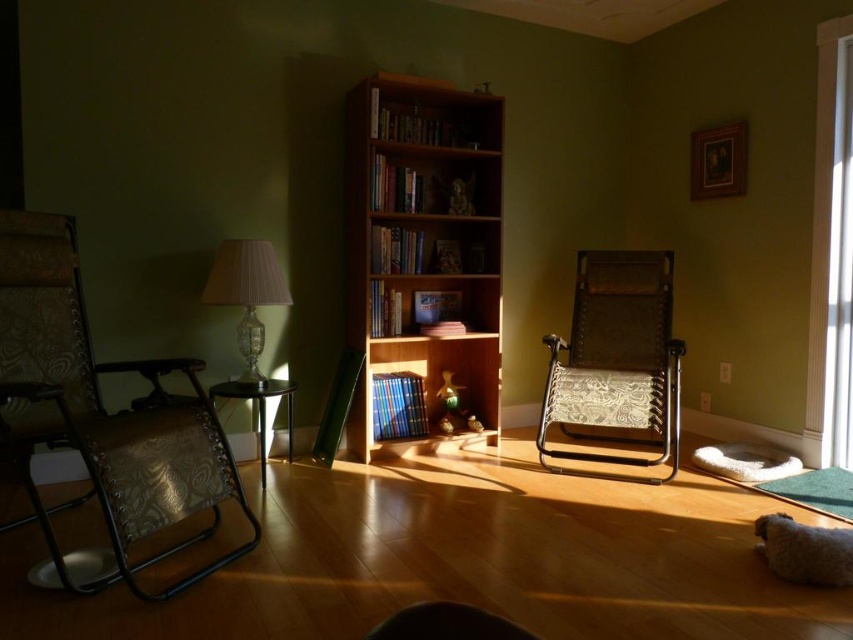
Question: Which object is the closest to the clear glass door at right?

Choices:
 (A) light wood bookcase at center
 (B) patterned fabric chair at left

Answer: (A)

Question: In this image, where is patterned fabric chair at left located relative to clear glass door at right?

Choices:
 (A) above
 (B) below

Answer: (B)

Question: Considering the real-world distances, which object is farthest from the light wood bookcase at center?

Choices:
 (A) patterned fabric chair at left
 (B) patterned fabric chair at right
 (C) clear glass door at right
 (D) translucent glass lamp at center left

Answer: (C)

Question: Can you confirm if light wood bookcase at center is positioned to the right of patterned fabric chair at right?

Choices:
 (A) yes
 (B) no

Answer: (B)

Question: Observing the image, what is the correct spatial positioning of patterned fabric chair at right in reference to translucent glass lamp at center left?

Choices:
 (A) above
 (B) below

Answer: (B)

Question: Which point appears farthest from the camera in this image?

Choices:
 (A) (218, 291)
 (B) (840, 458)

Answer: (B)